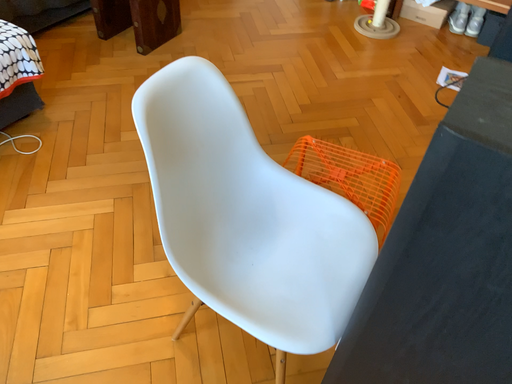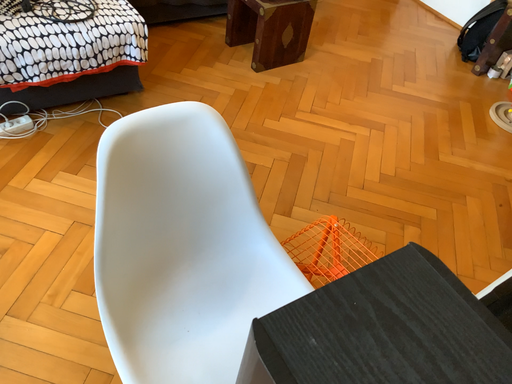
Question: How did the camera likely rotate when shooting the video?

Choices:
 (A) rotated right
 (B) rotated left

Answer: (B)